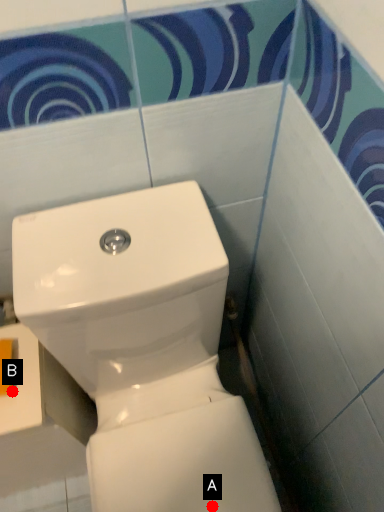
Question: Two points are circled on the image, labeled by A and B beside each circle. Which point is closer to the camera taking this photo?

Choices:
 (A) A is closer
 (B) B is closer

Answer: (B)